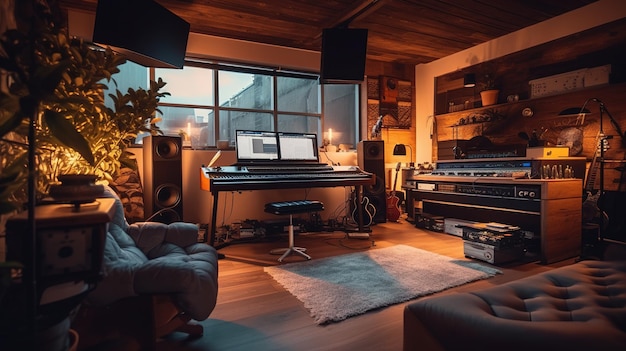
The height and width of the screenshot is (351, 626). Identify the location of left top speaker. (140, 26).